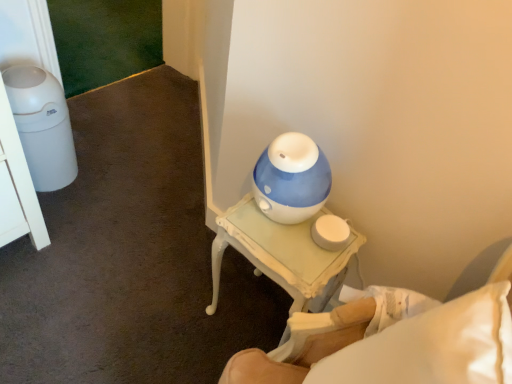
At what (x,y) coordinates should I click in order to perform the action: click on vacant region under white painted wood table at center (from a real-world perspective). Please return your answer as a coordinate pair (x, y). This screenshot has width=512, height=384. Looking at the image, I should click on [250, 311].